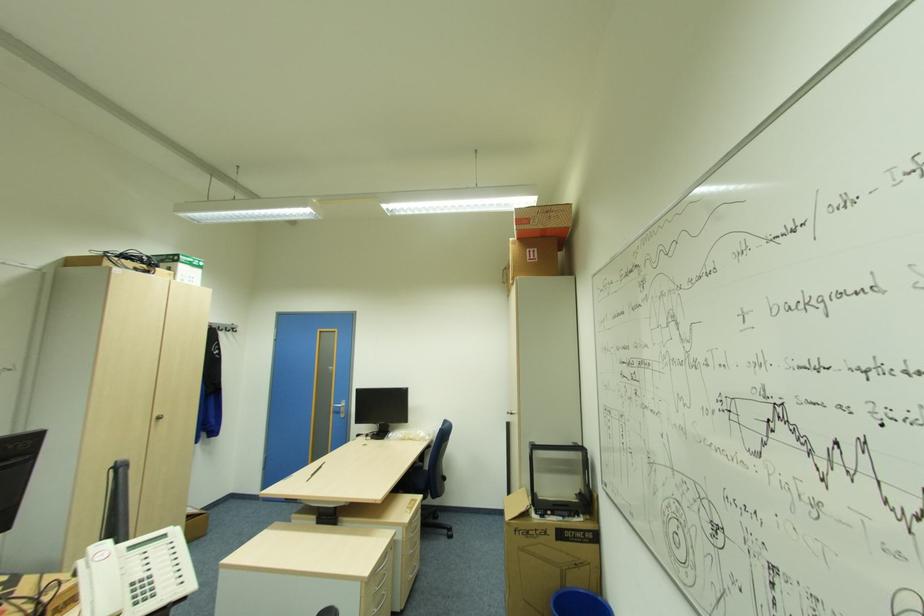
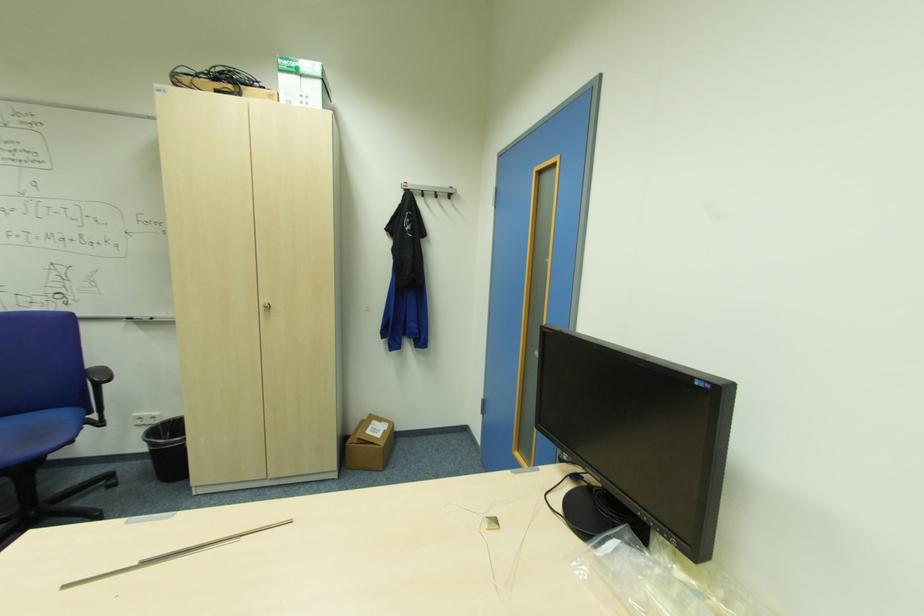
Where in the second image is the point corresponding to [310,480] from the first image?

(63, 589)